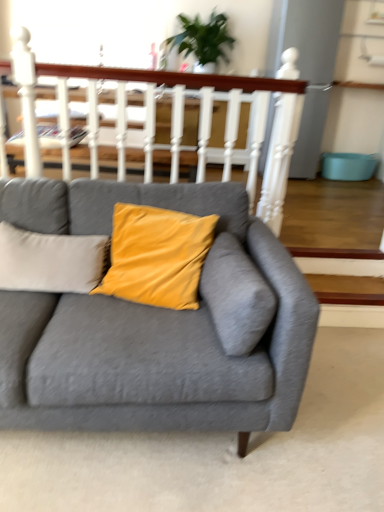
Question: Can you confirm if white wooden balustrade at upper center is taller than velvet yellow pillow at center?

Choices:
 (A) yes
 (B) no

Answer: (A)

Question: Is white wooden balustrade at upper center not near velvet yellow pillow at center?

Choices:
 (A) no
 (B) yes

Answer: (A)

Question: Considering the relative positions of white wooden balustrade at upper center and velvet yellow pillow at center in the image provided, is white wooden balustrade at upper center to the left of velvet yellow pillow at center from the viewer's perspective?

Choices:
 (A) yes
 (B) no

Answer: (B)

Question: Does white wooden balustrade at upper center have a larger size compared to velvet yellow pillow at center?

Choices:
 (A) no
 (B) yes

Answer: (B)

Question: From the image's perspective, does white wooden balustrade at upper center appear higher than velvet yellow pillow at center?

Choices:
 (A) no
 (B) yes

Answer: (B)

Question: From a real-world perspective, is white wooden balustrade at upper center on velvet yellow pillow at center?

Choices:
 (A) no
 (B) yes

Answer: (B)

Question: Is green leafy plant at upper center directly adjacent to white wooden balustrade at upper center?

Choices:
 (A) no
 (B) yes

Answer: (A)

Question: Could you tell me if green leafy plant at upper center is turned towards white wooden balustrade at upper center?

Choices:
 (A) yes
 (B) no

Answer: (A)

Question: Does green leafy plant at upper center appear on the left side of white wooden balustrade at upper center?

Choices:
 (A) no
 (B) yes

Answer: (A)

Question: From a real-world perspective, is green leafy plant at upper center under white wooden balustrade at upper center?

Choices:
 (A) no
 (B) yes

Answer: (A)

Question: Is green leafy plant at upper center to the right of white wooden balustrade at upper center from the viewer's perspective?

Choices:
 (A) no
 (B) yes

Answer: (B)

Question: Is green leafy plant at upper center closer to the viewer compared to white wooden balustrade at upper center?

Choices:
 (A) no
 (B) yes

Answer: (A)

Question: From the image's perspective, is white wooden balustrade at upper center under matte gray couch at center?

Choices:
 (A) no
 (B) yes

Answer: (A)